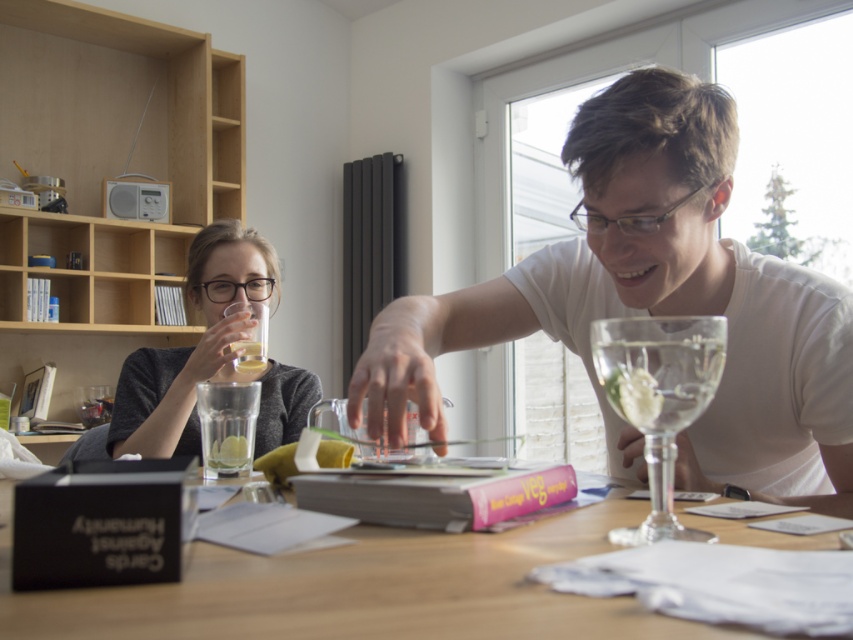
You are a photographer trying to capture a closeup of both the point at [245,236] and the point at [630,406] in the scene. Which point is closer to your camera lens?

The point at [245,236] is closer to the camera lens since it is further to the viewer than the point at [630,406].

You are a delivery robot trying to place a small package on the table in the image. The package must be placed exactly at point (x=209, y=356). Based on the scene, will the package be placed on the table or on the matte gray sweater at left?

The point (x=209, y=356) is on the matte gray sweater at left, so the package will be placed on the matte gray sweater at left instead of the table.

You are a delivery robot that needs to place a small package on the table without disturbing the matte gray sweater at left. Where should you place the package?

The package should be placed away from the matte gray sweater at left, which is located at coordinates point (209, 356).